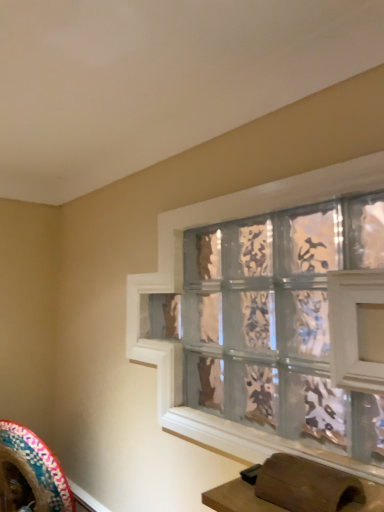
What do you see at coordinates (182, 292) in the screenshot? I see `clear glass window at upper center` at bounding box center [182, 292].

I want to click on clear glass window at upper center, so click(x=182, y=292).

Identify the location of clear glass window at upper center. The width and height of the screenshot is (384, 512). (182, 292).